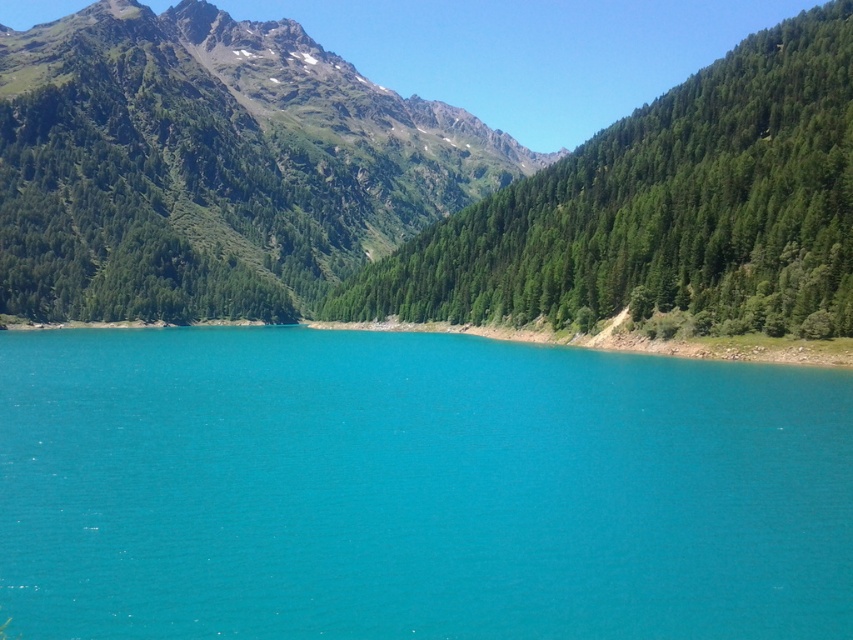
Between turquoise water at center and green textured mountain at upper left, which one has less height?

Standing shorter between the two is turquoise water at center.

Is turquoise water at center thinner than green textured mountain at upper left?

Yes, turquoise water at center is thinner than green textured mountain at upper left.

Which is behind, point (505, 458) or point (107, 100)?

Point (107, 100)

Where is `turquoise water at center`? Image resolution: width=853 pixels, height=640 pixels. turquoise water at center is located at coordinates (415, 490).

Can you confirm if turquoise water at center is taller than green textured tree at right?

No.

Is turquoise water at center positioned at the back of green textured tree at right?

No, turquoise water at center is in front of green textured tree at right.

Find the location of a particular element. This screenshot has height=640, width=853. turquoise water at center is located at coordinates (415, 490).

The height and width of the screenshot is (640, 853). I want to click on turquoise water at center, so click(x=415, y=490).

Can you confirm if green textured mountain at upper left is taller than green textured tree at right?

Yes.

Is green textured mountain at upper left positioned in front of green textured tree at right?

No, it is behind green textured tree at right.

Which is in front, point (80, 13) or point (776, 188)?

Positioned in front is point (776, 188).

Locate an element on the screen. The image size is (853, 640). green textured mountain at upper left is located at coordinates (212, 166).